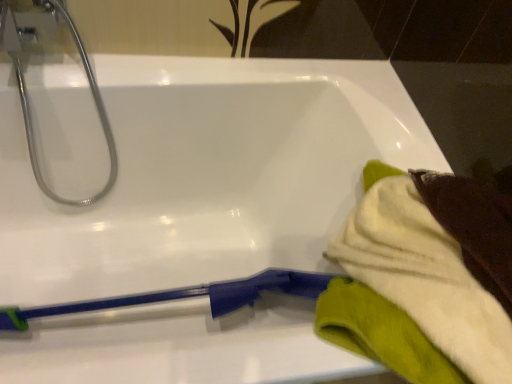
Question: Considering the positions of point (115, 150) and point (365, 238), is point (115, 150) closer or farther from the camera than point (365, 238)?

Choices:
 (A) farther
 (B) closer

Answer: (A)

Question: From their relative heights in the image, would you say silver metallic tap at upper left is taller or shorter than white soft towel at right?

Choices:
 (A) tall
 (B) short

Answer: (A)

Question: Is silver metallic tap at upper left inside the boundaries of white soft towel at right, or outside?

Choices:
 (A) outside
 (B) inside

Answer: (A)

Question: Is point (442, 195) closer or farther from the camera than point (99, 117)?

Choices:
 (A) farther
 (B) closer

Answer: (B)

Question: Based on their positions, is white soft towel at right located to the left or right of silver metallic tap at upper left?

Choices:
 (A) left
 (B) right

Answer: (B)

Question: Is white soft towel at right bigger or smaller than silver metallic tap at upper left?

Choices:
 (A) small
 (B) big

Answer: (A)

Question: From their relative heights in the image, would you say white soft towel at right is taller or shorter than silver metallic tap at upper left?

Choices:
 (A) tall
 (B) short

Answer: (B)